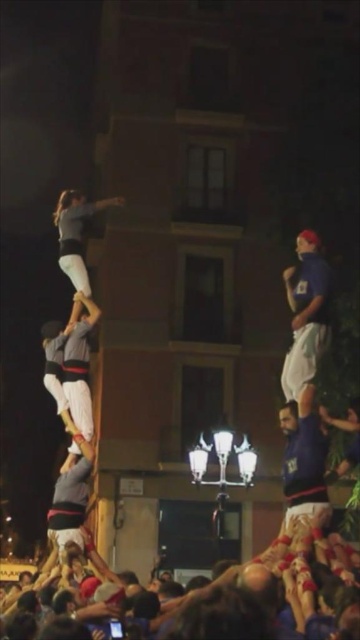
You are a photographer at the scene of the castells. You want to capture a photo that includes both the white cotton crowd at lower center and the blue fabric shirt at upper right. Which object should you focus on first to ensure both are in frame?

You should focus on the white cotton crowd at lower center first because it is larger than the blue fabric shirt at upper right, ensuring both can fit within the frame.

You are a photographer standing at the camera position. You want to capture a closeup shot of the point at coordinates (191, 637). Given that your camera can focus on objects within 100 feet, will the point be in focus?

The point at coordinates (191, 637) is 123.15 feet away from the camera, which is beyond the 100 feet focus range. Therefore, the point will not be in focus.